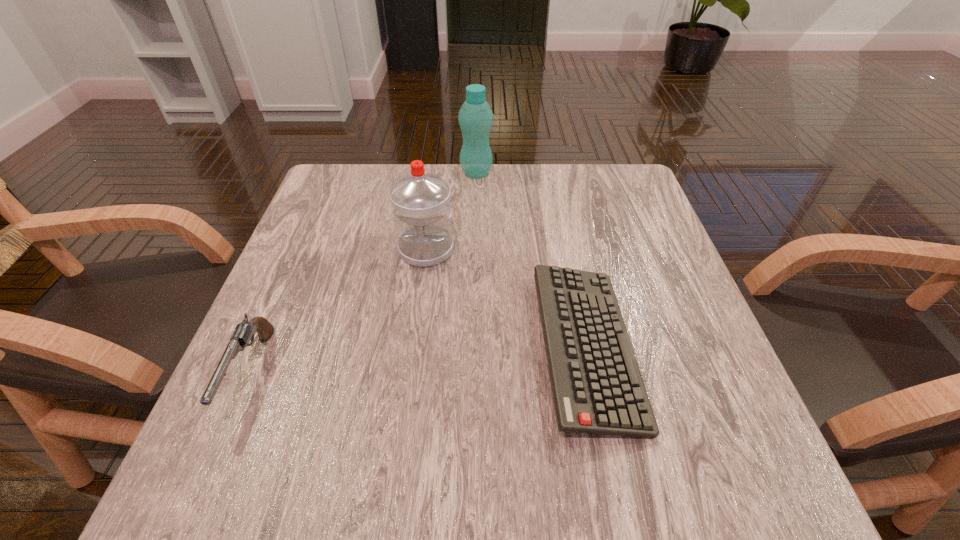
Find the location of `vacant space located 0.060m aiming along the barrel of the leftmost object`. vacant space located 0.060m aiming along the barrel of the leftmost object is located at coordinates 209,469.

This screenshot has height=540, width=960. Find the location of `free location located 0.320m on the left of the computer keyboard`. free location located 0.320m on the left of the computer keyboard is located at coordinates (360, 348).

At what (x,y) coordinates should I click in order to perform the action: click on object located in the far edge section of the desktop. Please return your answer as a coordinate pair (x, y). The height and width of the screenshot is (540, 960). Looking at the image, I should click on (475, 117).

I want to click on object positioned at the near edge, so click(597, 387).

Identify the location of object present at the left edge. (244, 332).

Find the location of a particular element. This screenshot has width=960, height=540. object situated at the right edge is located at coordinates (597, 387).

Locate an element on the screen. object situated at the near right corner is located at coordinates (597, 387).

Find the location of a particular element. The height and width of the screenshot is (540, 960). vacant region at the far edge of the desktop is located at coordinates (550, 184).

Locate an element on the screen. The width and height of the screenshot is (960, 540). free region at the near edge of the desktop is located at coordinates (380, 477).

The width and height of the screenshot is (960, 540). Find the location of `free space at the left edge of the desktop`. free space at the left edge of the desktop is located at coordinates 290,325.